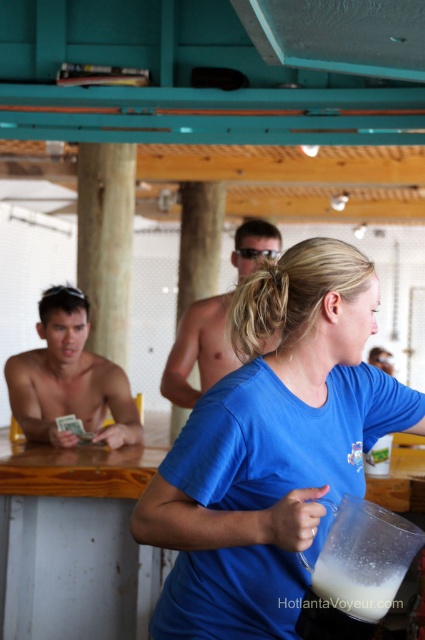
Question: Is blue fabric shirt at center closer to the viewer compared to teal matte exhaust hood at upper center?

Choices:
 (A) yes
 (B) no

Answer: (A)

Question: Considering the real-world distances, which object is farthest from the shiny metallic shirt at center?

Choices:
 (A) white frothy liquid at center
 (B) blue fabric shirt at center

Answer: (A)

Question: Which point is farther to the camera?

Choices:
 (A) (345, 582)
 (B) (260, 3)
 (C) (240, 241)
 (D) (331, 252)

Answer: (C)

Question: Can you confirm if shiny metallic shirt at center is wider than white frothy liquid at center?

Choices:
 (A) yes
 (B) no

Answer: (A)

Question: Which point is closer to the camera taking this photo?

Choices:
 (A) click(x=380, y=611)
 (B) click(x=45, y=358)

Answer: (A)

Question: Does blue fabric shirt at center lie in front of shiny metallic shirt at center?

Choices:
 (A) yes
 (B) no

Answer: (A)